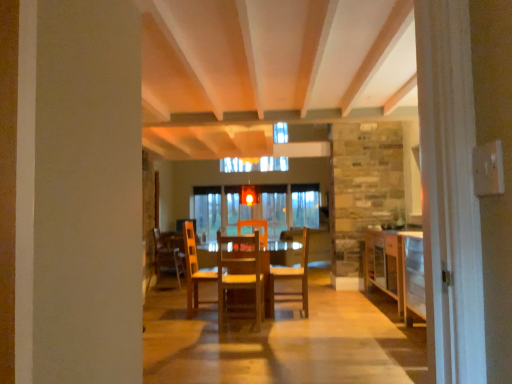
This screenshot has width=512, height=384. What do you see at coordinates (284, 251) in the screenshot?
I see `wooden table at center` at bounding box center [284, 251].

Describe the element at coordinates (241, 277) in the screenshot. The height and width of the screenshot is (384, 512). I see `wooden chair at center, the 1th chair positioned from the front` at that location.

At what (x,y) coordinates should I click in order to perform the action: click on wooden chair at center, the 1th chair positioned from the front. Please return your answer as a coordinate pair (x, y). The width and height of the screenshot is (512, 384). Looking at the image, I should click on (241, 277).

This screenshot has height=384, width=512. What are the coordinates of `wooden table at center` in the screenshot? It's located at (284, 251).

Considering the points (162, 257) and (386, 262), which point is behind, point (162, 257) or point (386, 262)?

The point (162, 257) is farther.

What's the angular difference between wooden chair at center, the third chair viewed from the front, and wooden cabinet at right's facing directions?

They differ by 177 degrees in their facing directions.

Does wooden chair at center, which is the 3th chair from right to left, have a greater height compared to wooden cabinet at right?

No, wooden chair at center, which is the 3th chair from right to left, is not taller than wooden cabinet at right.

From the image's perspective, is wooden chair at center, which is the 1th chair in back-to-front order, below wooden cabinet at right?

Yes.

Is wooden chair at center, the second chair when ordered from front to back, turned away from wooden table at center?

Correct, wooden chair at center, the second chair when ordered from front to back, is looking away from wooden table at center.

Relative to wooden table at center, is wooden chair at center, the second chair from the back, in front or behind?

wooden chair at center, the second chair from the back, is behind wooden table at center.

Can you tell me how much wooden chair at center, which appears as the first chair when viewed from the right, and wooden table at center differ in facing direction?

They differ by 90.3 degrees in their facing directions.

Is wooden chair at center, which appears as the first chair when viewed from the right, taller or shorter than wooden table at center?

Considering their sizes, wooden chair at center, which appears as the first chair when viewed from the right, has more height than wooden table at center.

Is wooden chair at center, which is the 3th chair from right to left, behind wooden chair at center, the second chair in the right-to-left sequence?

Yes, wooden chair at center, which is the 3th chair from right to left, is behind wooden chair at center, the second chair in the right-to-left sequence.

Can you confirm if wooden chair at center, the third chair viewed from the front, is positioned to the right of wooden chair at center, the 1th chair positioned from the front?

Incorrect, wooden chair at center, the third chair viewed from the front, is not on the right side of wooden chair at center, the 1th chair positioned from the front.

Could you tell me if wooden chair at center, marked as the 1th chair in a left-to-right arrangement, is turned towards wooden chair at center, the 1th chair positioned from the front?

No, wooden chair at center, marked as the 1th chair in a left-to-right arrangement, does not turn towards wooden chair at center, the 1th chair positioned from the front.

Is wooden chair at center, which is the 1th chair in back-to-front order, bigger or smaller than wooden chair at center, which ranks as the second chair in left-to-right order?

wooden chair at center, which is the 1th chair in back-to-front order, is bigger than wooden chair at center, which ranks as the second chair in left-to-right order.

From the image's perspective, is wooden cabinet at right located above wooden chair at center, the second chair when ordered from front to back?

No, from the image's perspective, wooden cabinet at right is not on top of wooden chair at center, the second chair when ordered from front to back.

Looking at this image, is wooden cabinet at right facing towards wooden chair at center, the second chair when ordered from front to back?

Yes.

From the image's perspective, is wooden cabinet at right on top of wooden chair at center, the second chair in the right-to-left sequence?

No, from the image's perspective, wooden cabinet at right is not over wooden chair at center, the second chair in the right-to-left sequence.

Considering the sizes of objects wooden cabinet at right and wooden chair at center, the 3th chair when ordered from back to front, in the image provided, who is smaller, wooden cabinet at right or wooden chair at center, the 3th chair when ordered from back to front,?

wooden chair at center, the 3th chair when ordered from back to front, is smaller.

Does wooden cabinet at right have a greater height compared to wooden chair at center, which ranks as the second chair in left-to-right order?

Yes.

Visually, is wooden cabinet at right positioned to the left or to the right of wooden chair at center, the 3th chair when ordered from back to front?

In the image, wooden cabinet at right appears on the right side of wooden chair at center, the 3th chair when ordered from back to front.

How many degrees apart are the facing directions of wooden chair at center, the second chair when ordered from front to back, and wooden chair at center, the 3th chair when ordered from back to front?

90.5 degrees.

Would you consider wooden chair at center, which appears as the third chair when viewed from the left, to be distant from wooden chair at center, the 1th chair positioned from the front?

That's not correct — wooden chair at center, which appears as the third chair when viewed from the left, is a little close to wooden chair at center, the 1th chair positioned from the front.

Can you confirm if wooden chair at center, the second chair when ordered from front to back, is positioned to the left of wooden chair at center, the 1th chair positioned from the front?

Incorrect, wooden chair at center, the second chair when ordered from front to back, is not on the left side of wooden chair at center, the 1th chair positioned from the front.

Considering the relative sizes of wooden chair at center, the second chair from the back, and wooden chair at center, the 3th chair when ordered from back to front, in the image provided, is wooden chair at center, the second chair from the back, smaller than wooden chair at center, the 3th chair when ordered from back to front,?

Yes, wooden chair at center, the second chair from the back, is smaller than wooden chair at center, the 3th chair when ordered from back to front.

From a real-world perspective, count 1st chairs upward from the wooden table at center and point to it. Please provide its 2D coordinates.

[(167, 257)]

Would you consider wooden chair at center, the third chair viewed from the front, to be distant from wooden table at center?

Yes.

Does wooden chair at center, marked as the 1th chair in a left-to-right arrangement, have a smaller size compared to wooden table at center?

Correct, wooden chair at center, marked as the 1th chair in a left-to-right arrangement, occupies less space than wooden table at center.

Where is `cabinetry on the right of wooden chair at center, which is the 1th chair in back-to-front order`? This screenshot has height=384, width=512. cabinetry on the right of wooden chair at center, which is the 1th chair in back-to-front order is located at coordinates (397, 269).

Identify the location of table that appears in front of the wooden chair at center, which appears as the first chair when viewed from the right. (284, 251).

Considering their positions, is wooden chair at center, which ranks as the second chair in left-to-right order, positioned closer to wooden cabinet at right than wooden chair at center, the second chair from the back?

The object closer to wooden cabinet at right is wooden chair at center, the second chair from the back.

When comparing their distances from wooden chair at center, the 3th chair when ordered from back to front, does wooden chair at center, which appears as the first chair when viewed from the right, or wooden chair at center, the third chair viewed from the front, seem further?

wooden chair at center, the third chair viewed from the front.

From the image, which object appears to be farther from wooden chair at center, which is the 3th chair from right to left, wooden chair at center, which appears as the first chair when viewed from the right, or wooden cabinet at right?

Among the two, wooden cabinet at right is located further to wooden chair at center, which is the 3th chair from right to left.

Considering their positions, is wooden chair at center, the second chair when ordered from front to back, positioned closer to wooden table at center than wooden cabinet at right?

wooden chair at center, the second chair when ordered from front to back.

Looking at the image, which one is located further to wooden chair at center, the third chair viewed from the front, wooden cabinet at right or wooden table at center?

The object further to wooden chair at center, the third chair viewed from the front, is wooden cabinet at right.

Looking at this image, looking at the image, which one is located further to wooden table at center, wooden chair at center, the second chair in the right-to-left sequence, or wooden chair at center, which appears as the first chair when viewed from the right?

wooden chair at center, the second chair in the right-to-left sequence, is positioned further to the anchor wooden table at center.

When comparing their distances from wooden chair at center, which ranks as the second chair in left-to-right order, does wooden table at center or wooden chair at center, which appears as the third chair when viewed from the left, seem further?

Based on the image, wooden table at center appears to be further to wooden chair at center, which ranks as the second chair in left-to-right order.

Based on their spatial positions, is wooden chair at center, which is the 1th chair in back-to-front order, or wooden chair at center, the second chair when ordered from front to back, further from wooden chair at center, the 1th chair positioned from the front?

wooden chair at center, which is the 1th chair in back-to-front order, is further to wooden chair at center, the 1th chair positioned from the front.

Locate an element on the screen. chair positioned between wooden table at center and wooden chair at center, which is the 3th chair from right to left, from near to far is located at coordinates (295, 276).

At what (x,y) coordinates should I click in order to perform the action: click on table between wooden chair at center, the 1th chair positioned from the front, and wooden chair at center, which is the 1th chair in back-to-front order, in the front-back direction. Please return your answer as a coordinate pair (x, y). Looking at the image, I should click on (284, 251).

In order to click on chair located between wooden table at center and wooden cabinet at right in the left-right direction in this screenshot , I will do `click(295, 276)`.

Identify the location of table between wooden chair at center, which is the 1th chair in back-to-front order, and wooden cabinet at right, in the horizontal direction. This screenshot has height=384, width=512. (284, 251).